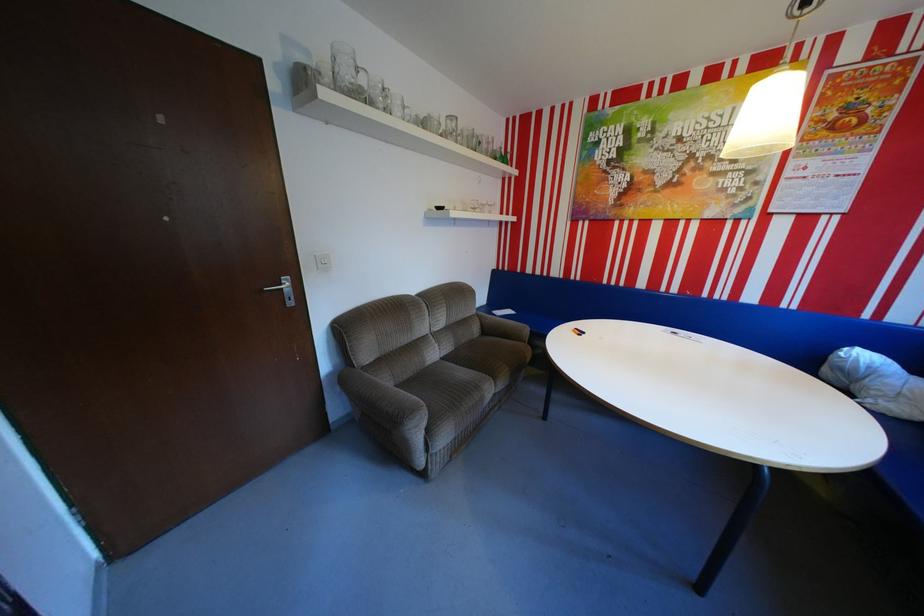
Locate an element on the screen. The height and width of the screenshot is (616, 924). white light switch is located at coordinates (322, 261).